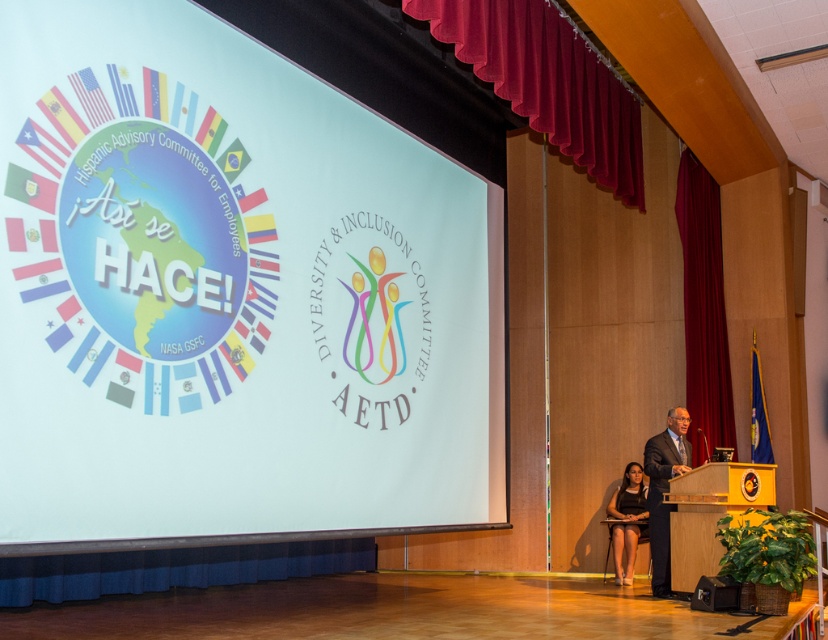
You are a stagehand who needs to place a 15 feet long decorative banner between the velvet red curtain at upper center and the blue pleated fabric at lower center. Can the banner fit between them without overlapping either object?

The velvet red curtain at upper center and blue pleated fabric at lower center are 17.80 feet apart. Since the banner is 15 feet long, it can fit between them without overlapping as there is enough space.

You are an event coordinator who needs to ensure there is enough space between the velvet red curtain at upper center and the black suit at center for a presenter to walk through comfortably. The presenter requires a minimum of 8 feet of clearance. Can the presenter move through the space between them?

The velvet red curtain at upper center and black suit at center are 10.38 feet apart from each other, which exceeds the required 8 feet of clearance. Therefore, the presenter can comfortably move through the space between them.